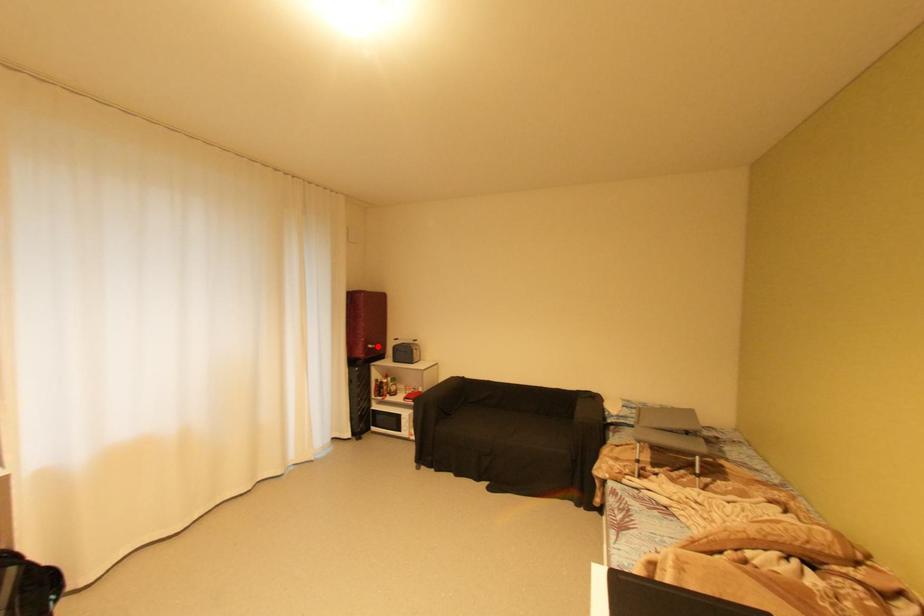
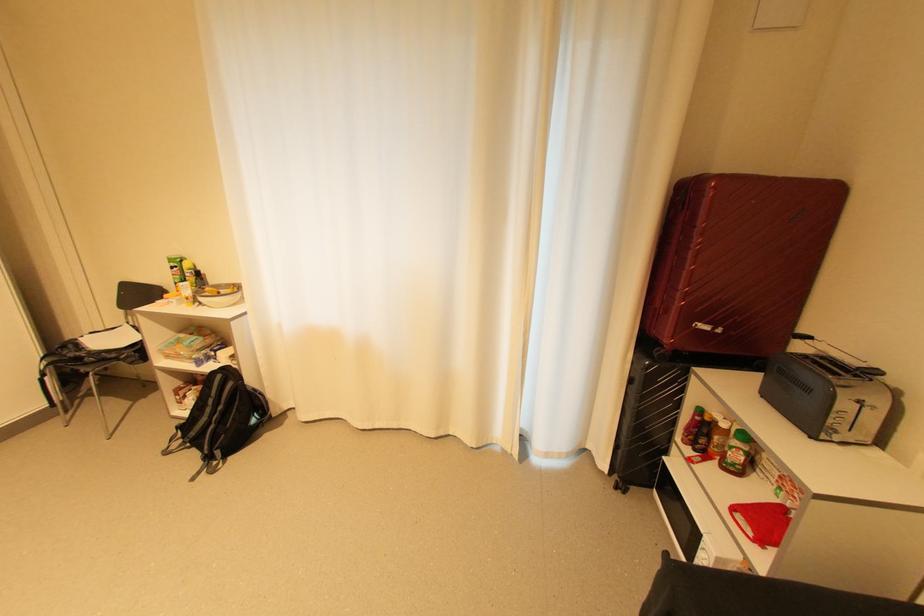
In the second image, find the point that corresponds to the highlighted location in the first image.

(713, 328)